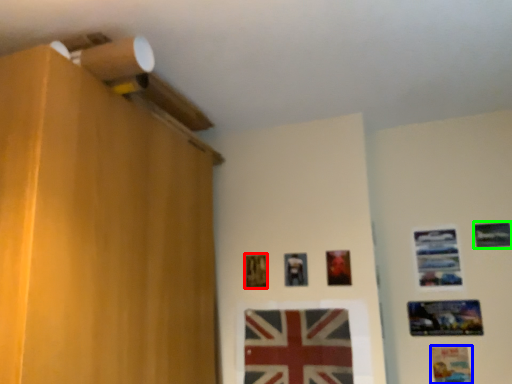
Question: Which object is the farthest from picture frame (highlighted by a red box)? Choose among these: picture frame (highlighted by a blue box) or picture frame (highlighted by a green box).

Choices:
 (A) picture frame
 (B) picture frame

Answer: (B)